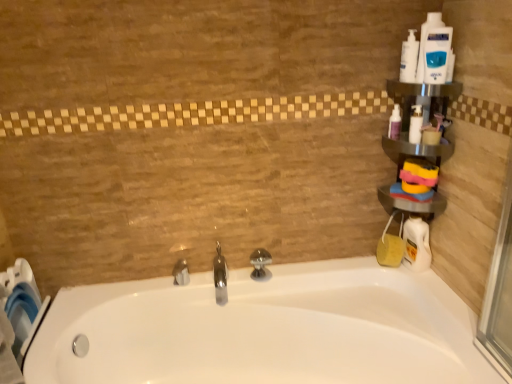
Question: From a real-world perspective, is silver metallic tap at center, which is counted as the 3th tap, starting from the right, beneath polished chrome tap at center, positioned as the 1th tap in right-to-left order?

Choices:
 (A) no
 (B) yes

Answer: (B)

Question: Is silver metallic tap at center, marked as the 1th tap in a left-to-right arrangement, wider than polished chrome tap at center, arranged as the third tap when viewed from the left?

Choices:
 (A) no
 (B) yes

Answer: (A)

Question: Is polished chrome tap at center, arranged as the third tap when viewed from the left, inside silver metallic tap at center, which is counted as the 3th tap, starting from the right?

Choices:
 (A) no
 (B) yes

Answer: (A)

Question: Is silver metallic tap at center, which is counted as the 3th tap, starting from the right, bigger than polished chrome tap at center, positioned as the 1th tap in right-to-left order?

Choices:
 (A) yes
 (B) no

Answer: (B)

Question: Is silver metallic tap at center, marked as the 1th tap in a left-to-right arrangement, at the left side of polished chrome tap at center, positioned as the 1th tap in right-to-left order?

Choices:
 (A) yes
 (B) no

Answer: (A)

Question: Is polished chrome faucet at center, which is counted as the 2th tap, starting from the left, in front of or behind metallic silver shelf at upper right in the image?

Choices:
 (A) front
 (B) behind

Answer: (B)

Question: Considering the positions of polished chrome faucet at center, which is counted as the 2th tap, starting from the left, and metallic silver shelf at upper right in the image, is polished chrome faucet at center, which is counted as the 2th tap, starting from the left, wider or thinner than metallic silver shelf at upper right?

Choices:
 (A) thin
 (B) wide

Answer: (B)

Question: Visually, is polished chrome faucet at center, which is counted as the 2th tap, starting from the left, positioned to the left or to the right of metallic silver shelf at upper right?

Choices:
 (A) right
 (B) left

Answer: (B)

Question: Based on their sizes in the image, would you say polished chrome faucet at center, marked as the second tap in a right-to-left arrangement, is bigger or smaller than metallic silver shelf at upper right?

Choices:
 (A) big
 (B) small

Answer: (B)

Question: Considering their positions, is white plastic bottle at upper right, the first cleaning product viewed from the top, located in front of or behind silver metallic tap at center, which is counted as the 3th tap, starting from the right?

Choices:
 (A) behind
 (B) front

Answer: (B)

Question: Which is correct: white plastic bottle at upper right, arranged as the fifth cleaning product when ordered from the bottom, is inside silver metallic tap at center, marked as the 1th tap in a left-to-right arrangement, or outside of it?

Choices:
 (A) outside
 (B) inside

Answer: (A)

Question: From the image's perspective, relative to silver metallic tap at center, marked as the 1th tap in a left-to-right arrangement, is white plastic bottle at upper right, arranged as the fifth cleaning product when ordered from the bottom, above or below?

Choices:
 (A) above
 (B) below

Answer: (A)

Question: From a real-world perspective, is white plastic bottle at upper right, the first cleaning product viewed from the top, physically located above or below silver metallic tap at center, marked as the 1th tap in a left-to-right arrangement?

Choices:
 (A) above
 (B) below

Answer: (A)

Question: In the image, is translucent plastic bottle at upper right, arranged as the 3th cleaning product when ordered from the bottom, positioned in front of or behind white glossy bathtub at center?

Choices:
 (A) behind
 (B) front

Answer: (A)

Question: From a real-world perspective, is translucent plastic bottle at upper right, positioned as the 3th cleaning product in top-to-bottom order, positioned above or below white glossy bathtub at center?

Choices:
 (A) above
 (B) below

Answer: (A)